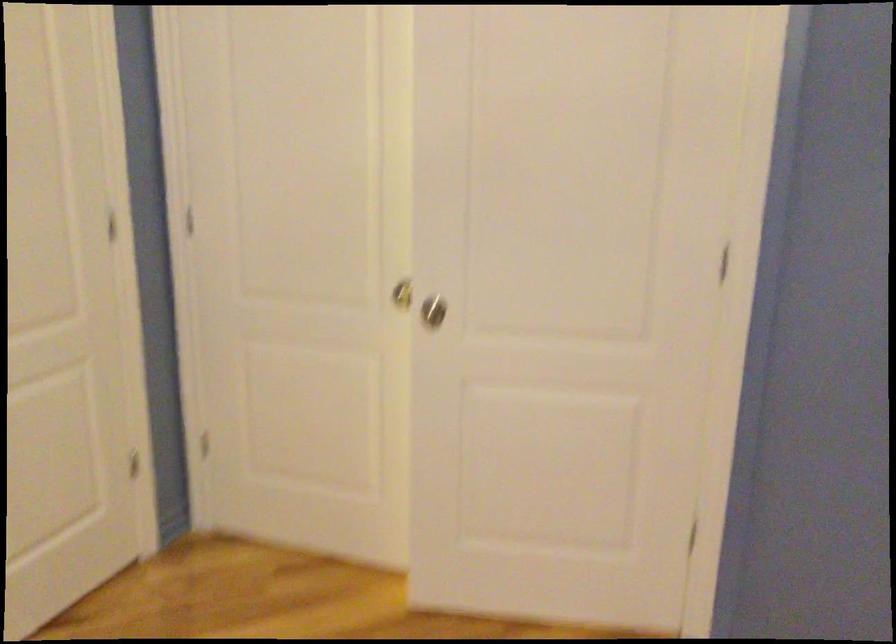
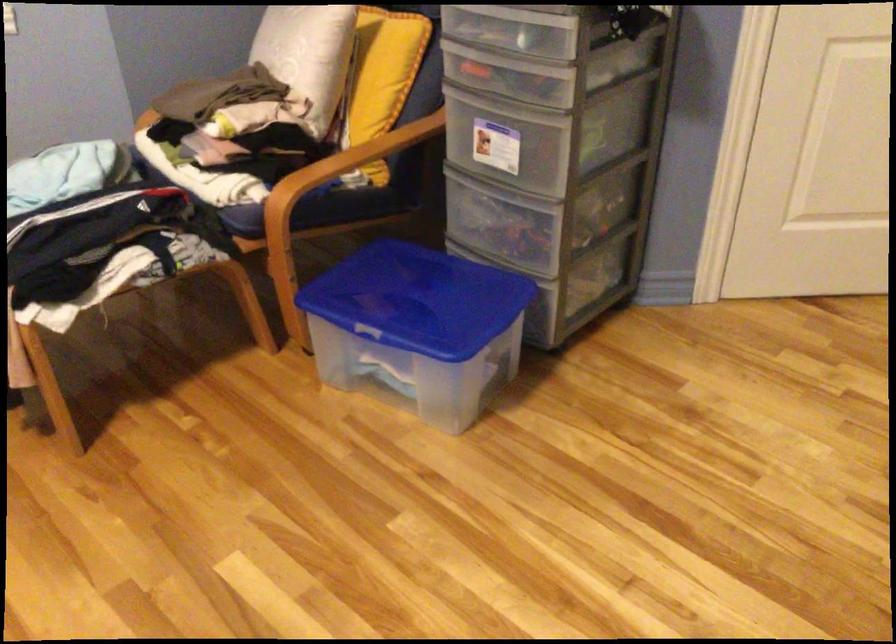
How did the camera likely rotate?

The camera's rotation is toward left-down.